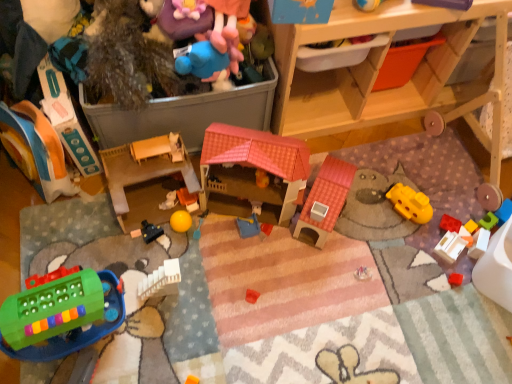
At what (x,y) coordinates should I click in order to perform the action: click on vacant space behind white plastic toy at lower right, positioned as the 4th toy in right-to-left order. Please return your answer as a coordinate pair (x, y). Looking at the image, I should click on (446, 209).